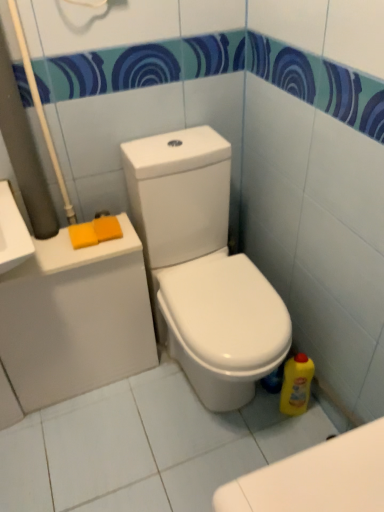
Question: Is the position of orange sponge at upper left, which is the 1th soap from right to left, more distant than that of white glossy toilet at center?

Choices:
 (A) no
 (B) yes

Answer: (B)

Question: Is orange sponge at upper left, which is the second soap in left-to-right order, not inside white glossy toilet at center?

Choices:
 (A) yes
 (B) no

Answer: (A)

Question: Is the position of orange sponge at upper left, which is the second soap in left-to-right order, less distant than that of white glossy toilet at center?

Choices:
 (A) no
 (B) yes

Answer: (A)

Question: Is orange sponge at upper left, which is the second soap in left-to-right order, looking in the opposite direction of white glossy toilet at center?

Choices:
 (A) no
 (B) yes

Answer: (A)

Question: Is orange sponge at upper left, which is the second soap in left-to-right order, thinner than white glossy toilet at center?

Choices:
 (A) yes
 (B) no

Answer: (A)

Question: Is orange sponge at upper left, which is the second soap in left-to-right order, in contact with white glossy toilet at center?

Choices:
 (A) no
 (B) yes

Answer: (A)

Question: Considering the relative positions of orange sponge at left, the first soap in the left-to-right sequence, and yellow plastic bottle at lower right in the image provided, is orange sponge at left, the first soap in the left-to-right sequence, behind yellow plastic bottle at lower right?

Choices:
 (A) no
 (B) yes

Answer: (A)

Question: Considering the relative sizes of orange sponge at left, the first soap in the left-to-right sequence, and yellow plastic bottle at lower right in the image provided, is orange sponge at left, the first soap in the left-to-right sequence, taller than yellow plastic bottle at lower right?

Choices:
 (A) no
 (B) yes

Answer: (A)

Question: Considering the relative sizes of orange sponge at left, the first soap in the left-to-right sequence, and yellow plastic bottle at lower right in the image provided, is orange sponge at left, the first soap in the left-to-right sequence, shorter than yellow plastic bottle at lower right?

Choices:
 (A) no
 (B) yes

Answer: (B)

Question: From the image's perspective, is orange sponge at left, the 2th soap positioned from the right, above yellow plastic bottle at lower right?

Choices:
 (A) yes
 (B) no

Answer: (A)

Question: Does orange sponge at left, the 2th soap positioned from the right, appear on the right side of yellow plastic bottle at lower right?

Choices:
 (A) yes
 (B) no

Answer: (B)

Question: Is orange sponge at left, the 2th soap positioned from the right, in contact with yellow plastic bottle at lower right?

Choices:
 (A) no
 (B) yes

Answer: (A)

Question: Is white glossy toilet at center oriented towards orange sponge at upper left, which is the second soap in left-to-right order?

Choices:
 (A) yes
 (B) no

Answer: (B)